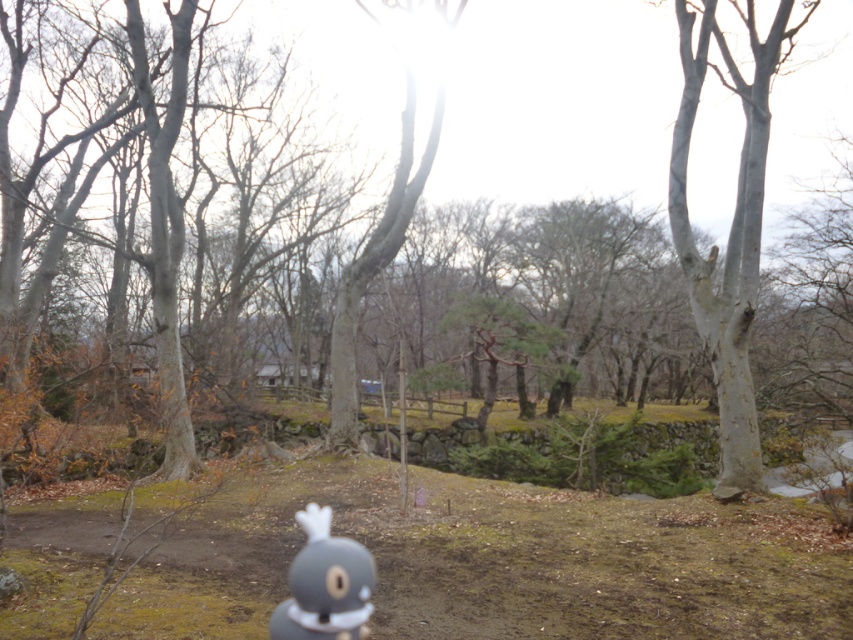
Does point (788, 51) come in front of point (328, 636)?

No, it is not.

Can you confirm if smooth gray bark at center is thinner than gray matte plush toy at lower center?

No, smooth gray bark at center is not thinner than gray matte plush toy at lower center.

At what (x,y) coordinates should I click in order to perform the action: click on smooth gray bark at center. Please return your answer as a coordinate pair (x, y). Looking at the image, I should click on (729, 228).

The height and width of the screenshot is (640, 853). Identify the location of smooth gray bark at center. (729, 228).